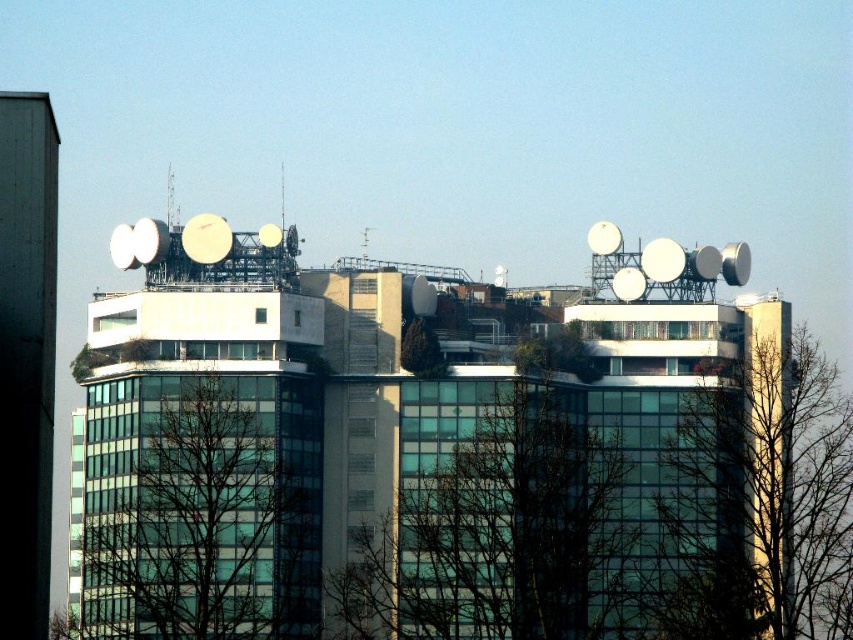
Which is more to the right, green leafless tree at left or green leafy tree at right?

green leafy tree at right

Can you confirm if green leafless tree at left is positioned to the left of green leafy tree at right?

Correct, you'll find green leafless tree at left to the left of green leafy tree at right.

Locate an element on the screen. This screenshot has width=853, height=640. green leafless tree at left is located at coordinates (202, 509).

Between green leafy tree at center and green leafy tree at right, which one appears on the right side from the viewer's perspective?

Positioned to the right is green leafy tree at right.

Is point (581, 600) positioned behind point (804, 380)?

That is True.

The image size is (853, 640). In order to click on green leafy tree at center in this screenshot , I will do `click(496, 518)`.

Who is lower down, green leafy tree at center or green leafless tree at left?

green leafy tree at center is lower down.

Can you confirm if green leafy tree at center is positioned to the right of green leafless tree at left?

Yes, green leafy tree at center is to the right of green leafless tree at left.

At what (x,y) coordinates should I click in order to perform the action: click on green leafy tree at center. Please return your answer as a coordinate pair (x, y). This screenshot has height=640, width=853. Looking at the image, I should click on (496, 518).

Locate an element on the screen. green leafy tree at center is located at coordinates (496, 518).